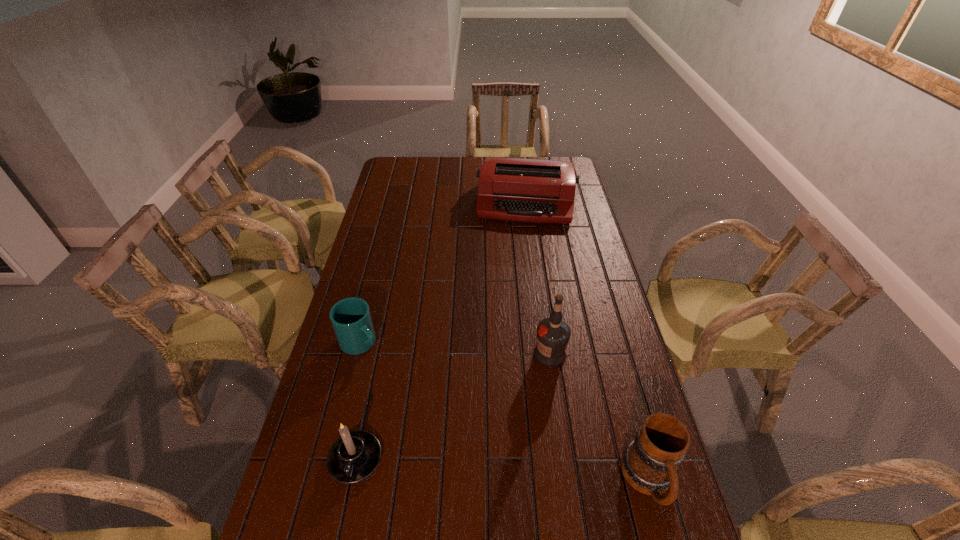
In order to click on typewriter that is at the right edge in this screenshot , I will do `click(526, 190)`.

Identify the location of object situated at the far right corner. This screenshot has height=540, width=960. (526, 190).

Locate an element on the screen. object that is at the near right corner is located at coordinates (649, 463).

In the image, there is a desktop. Where is `vacant space at the far edge`? This screenshot has height=540, width=960. vacant space at the far edge is located at coordinates (446, 160).

Locate an element on the screen. This screenshot has width=960, height=540. vacant space at the left edge of the desktop is located at coordinates 375,326.

I want to click on vacant space at the right edge, so click(x=581, y=286).

Identify the location of free spot between the candle holder and the typewriter. The image size is (960, 540). (441, 331).

Find the location of `empty space that is in between the mug and the farthest object`. empty space that is in between the mug and the farthest object is located at coordinates (588, 342).

You are a GUI agent. You are given a task and a screenshot of the screen. Output one action in this format:
    pyautogui.click(x=<x>, y=<y>)
    Task: Click on the vacant area that lies between the candle holder and the farthest object
    
    Given the screenshot: What is the action you would take?
    pyautogui.click(x=441, y=331)

Where is `vacant space that's between the vodka and the cup`? Image resolution: width=960 pixels, height=540 pixels. vacant space that's between the vodka and the cup is located at coordinates (455, 348).